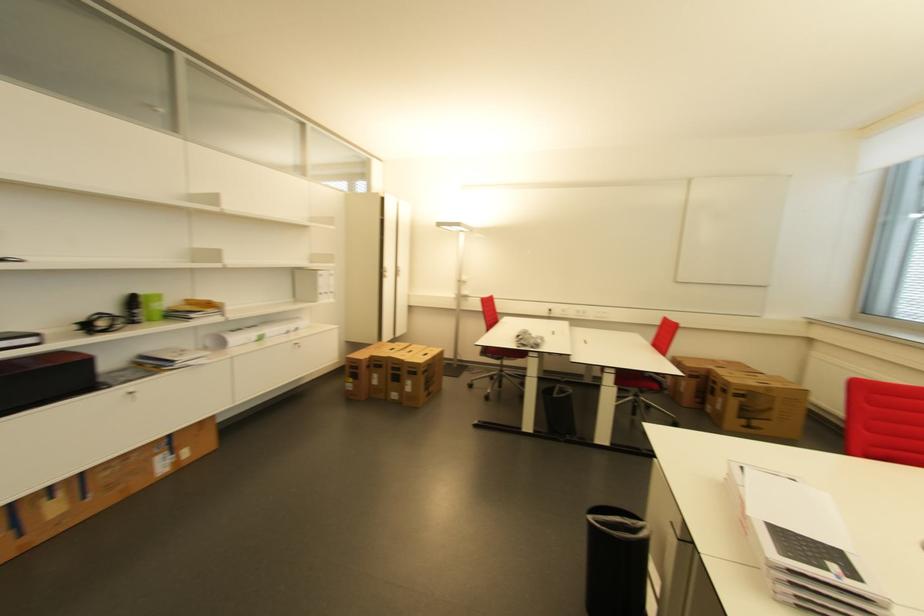
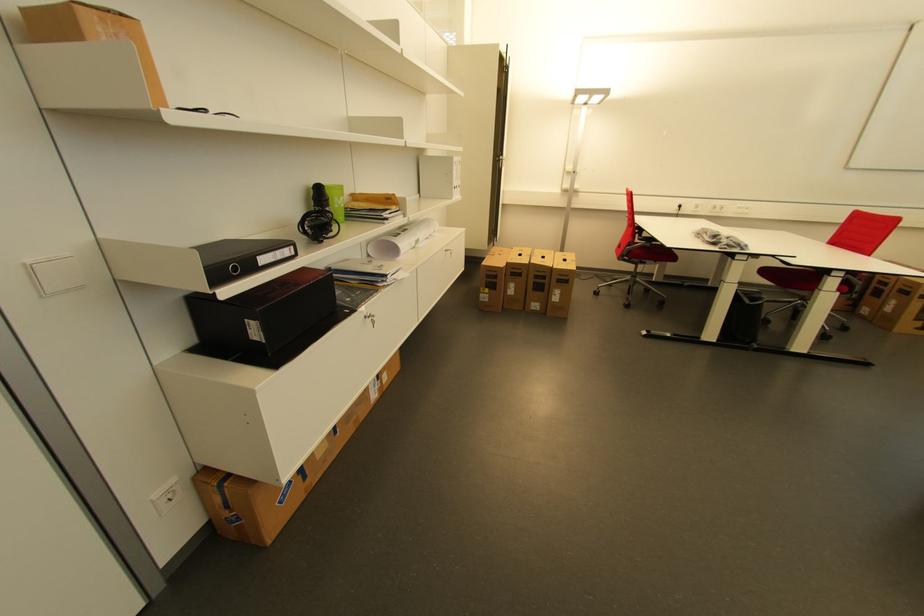
Where in the second image is the point corresponding to point 142,395 from the first image?

(380, 320)